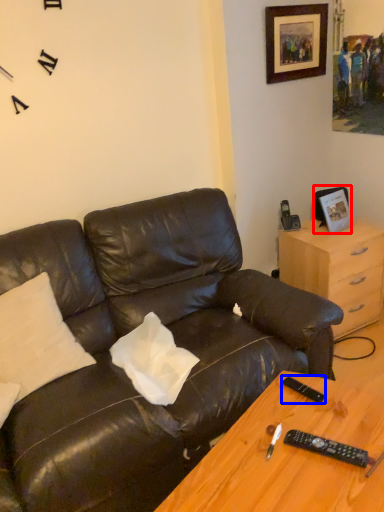
Question: Which object is further to the camera taking this photo, picture frame (highlighted by a red box) or remote (highlighted by a blue box)?

Choices:
 (A) picture frame
 (B) remote

Answer: (A)